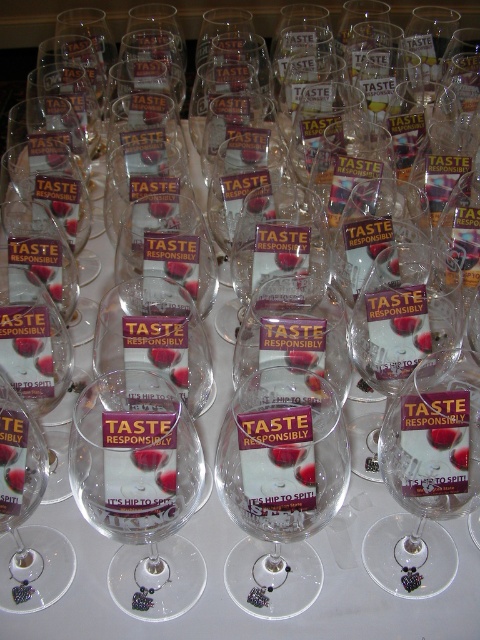
You are at a wine tasting event and need to choose a glass to hold your wine. The clear glass wine glass at center and the matte glass at center are both available. Which glass has a wider opening for swirling the wine?

The clear glass wine glass at center has a larger width than the matte glass at center, so it has a wider opening for swirling the wine.

You are at a wine tasting event and see the clear glass wine glass at center and the clear glass wine at center. Which one has a larger diameter at the top?

The clear glass wine glass at center is wider than the clear glass wine at center, so the clear glass wine glass at center has a larger diameter at the top.

In the scene shown: You are at a wine tasting event and see the clear glass wine glass at center and the clear glass wine at center. Which one is taller?

The clear glass wine glass at center is taller than the clear glass wine at center.